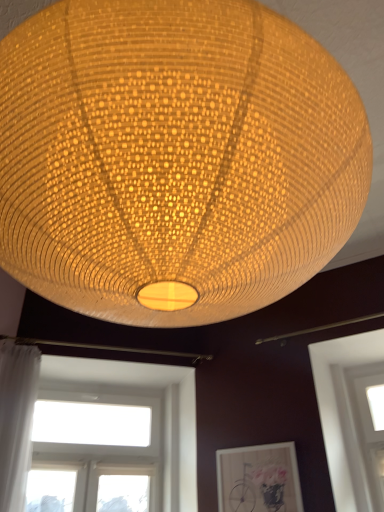
What do you see at coordinates (165, 407) in the screenshot? This screenshot has height=512, width=384. I see `white glass window at lower left, marked as the first window in a left-to-right arrangement` at bounding box center [165, 407].

Describe the element at coordinates (16, 420) in the screenshot. I see `white sheer curtain at left` at that location.

The image size is (384, 512). I want to click on white sheer curtain at left, so coord(16,420).

Identify the location of white glass window at lower left, marked as the second window in a right-to-left arrangement. This screenshot has height=512, width=384. (165, 407).

Which of these two, matte woven lampshade at center or matte wooden picture frame at lower center, stands shorter?

matte wooden picture frame at lower center is shorter.

Who is more distant, matte woven lampshade at center or matte wooden picture frame at lower center?

Positioned behind is matte wooden picture frame at lower center.

Would you say matte woven lampshade at center is outside matte wooden picture frame at lower center?

Yes, matte woven lampshade at center is not within matte wooden picture frame at lower center.

Is matte woven lampshade at center to the right of matte wooden picture frame at lower center from the viewer's perspective?

No, matte woven lampshade at center is not to the right of matte wooden picture frame at lower center.

How many degrees apart are the facing directions of matte woven lampshade at center and transparent glass window at lower right, the second window positioned from the left?

matte woven lampshade at center and transparent glass window at lower right, the second window positioned from the left, are facing 91.4 degrees away from each other.

Is point (177, 293) closer or farther from the camera than point (379, 367)?

Point (177, 293) appears to be closer to the viewer than point (379, 367).

Between matte woven lampshade at center and transparent glass window at lower right, the first window from the right, which one has more height?

With more height is matte woven lampshade at center.

Would you consider matte woven lampshade at center to be distant from transparent glass window at lower right, the first window from the right?

Yes, matte woven lampshade at center and transparent glass window at lower right, the first window from the right, are located far from each other.

Is transparent glass window at lower right, the first window from the right, looking in the opposite direction of matte woven lampshade at center?

No.

Is the position of transparent glass window at lower right, the second window positioned from the left, more distant than that of matte woven lampshade at center?

Yes.

Who is smaller, transparent glass window at lower right, the first window from the right, or matte woven lampshade at center?

transparent glass window at lower right, the first window from the right, is smaller.

Is point (352, 409) more distant than point (135, 294)?

Yes, it is behind point (135, 294).

From the image's perspective, is matte woven lampshade at center positioned above or below white glass window at lower left, marked as the second window in a right-to-left arrangement?

matte woven lampshade at center is situated higher than white glass window at lower left, marked as the second window in a right-to-left arrangement, in the image.

Which of these two, matte woven lampshade at center or white glass window at lower left, marked as the first window in a left-to-right arrangement, is thinner?

With smaller width is white glass window at lower left, marked as the first window in a left-to-right arrangement.

Which is more to the right, matte woven lampshade at center or white glass window at lower left, marked as the first window in a left-to-right arrangement?

From the viewer's perspective, matte woven lampshade at center appears more on the right side.

Is white glass window at lower left, marked as the second window in a right-to-left arrangement, a part of matte woven lampshade at center?

No.

Is transparent glass window at lower right, the first window from the right, aimed at white glass window at lower left, marked as the first window in a left-to-right arrangement?

No, transparent glass window at lower right, the first window from the right, is not oriented towards white glass window at lower left, marked as the first window in a left-to-right arrangement.

Is transparent glass window at lower right, the first window from the right, taller or shorter than white glass window at lower left, marked as the second window in a right-to-left arrangement?

Considering their sizes, transparent glass window at lower right, the first window from the right, has more height than white glass window at lower left, marked as the second window in a right-to-left arrangement.

Measure the distance between transparent glass window at lower right, the first window from the right, and white glass window at lower left, marked as the second window in a right-to-left arrangement.

1.33 meters.

Identify the location of window located underneath the white glass window at lower left, marked as the first window in a left-to-right arrangement (from a real-world perspective). (367, 426).

Which is closer to the camera, (105, 379) or (14, 408)?

Point (105, 379) appears to be farther away from the viewer than point (14, 408).

Which window is the 2nd one when counting from the back of the white sheer curtain at left? Please provide its 2D coordinates.

[(165, 407)]

Can you confirm if white glass window at lower left, marked as the second window in a right-to-left arrangement, is thinner than white sheer curtain at left?

No, white glass window at lower left, marked as the second window in a right-to-left arrangement, is not thinner than white sheer curtain at left.

From the image's perspective, between white glass window at lower left, marked as the second window in a right-to-left arrangement, and matte wooden picture frame at lower center, who is located below?

white glass window at lower left, marked as the second window in a right-to-left arrangement, is shown below in the image.

Which is more distant, [70,367] or [284,487]?

The point [70,367] is more distant.

Where is `window below the matte wooden picture frame at lower center (from the image's perspective)`? Image resolution: width=384 pixels, height=512 pixels. window below the matte wooden picture frame at lower center (from the image's perspective) is located at coordinates (165, 407).

Find the location of a particular element. The width and height of the screenshot is (384, 512). lamp lying on the left of matte wooden picture frame at lower center is located at coordinates (174, 158).

From the matte woven lampshade at center, count 1st windows backward and point to it. Please provide its 2D coordinates.

[(367, 426)]

Based on their spatial positions, is matte woven lampshade at center or white sheer curtain at left closer to white glass window at lower left, marked as the second window in a right-to-left arrangement?

white sheer curtain at left is closer to white glass window at lower left, marked as the second window in a right-to-left arrangement.

Looking at the image, which one is located closer to matte wooden picture frame at lower center, matte woven lampshade at center or transparent glass window at lower right, the first window from the right?

The object closer to matte wooden picture frame at lower center is transparent glass window at lower right, the first window from the right.

Based on their spatial positions, is transparent glass window at lower right, the first window from the right, or white glass window at lower left, marked as the second window in a right-to-left arrangement, closer to matte wooden picture frame at lower center?

The object closer to matte wooden picture frame at lower center is white glass window at lower left, marked as the second window in a right-to-left arrangement.

Estimate the real-world distances between objects in this image. Which object is further from white sheer curtain at left, matte wooden picture frame at lower center or transparent glass window at lower right, the second window positioned from the left?

Answer: transparent glass window at lower right, the second window positioned from the left, is positioned further to the anchor white sheer curtain at left.

When comparing their distances from white sheer curtain at left, does matte woven lampshade at center or white glass window at lower left, marked as the second window in a right-to-left arrangement, seem closer?

white glass window at lower left, marked as the second window in a right-to-left arrangement, lies closer to white sheer curtain at left than the other object.

Based on their spatial positions, is transparent glass window at lower right, the second window positioned from the left, or matte woven lampshade at center closer to white sheer curtain at left?

transparent glass window at lower right, the second window positioned from the left, is closer to white sheer curtain at left.

From the image, which object appears to be farther from white glass window at lower left, marked as the first window in a left-to-right arrangement, white sheer curtain at left or matte woven lampshade at center?

The object further to white glass window at lower left, marked as the first window in a left-to-right arrangement, is matte woven lampshade at center.

Estimate the real-world distances between objects in this image. Which object is further from matte wooden picture frame at lower center, white glass window at lower left, marked as the first window in a left-to-right arrangement, or matte woven lampshade at center?

Based on the image, matte woven lampshade at center appears to be further to matte wooden picture frame at lower center.

Find the location of a particular element. Image resolution: width=384 pixels, height=512 pixels. window between matte woven lampshade at center and white glass window at lower left, marked as the first window in a left-to-right arrangement, from front to back is located at coordinates (367, 426).

At what (x,y) coordinates should I click in order to perform the action: click on window between white sheer curtain at left and matte wooden picture frame at lower center in the horizontal direction. Please return your answer as a coordinate pair (x, y). Looking at the image, I should click on (165, 407).

Locate an element on the screen. Image resolution: width=384 pixels, height=512 pixels. curtain between matte woven lampshade at center and matte wooden picture frame at lower center along the z-axis is located at coordinates (16, 420).

This screenshot has width=384, height=512. What are the coordinates of `curtain between matte woven lampshade at center and transparent glass window at lower right, the first window from the right, from front to back` in the screenshot? It's located at [16, 420].